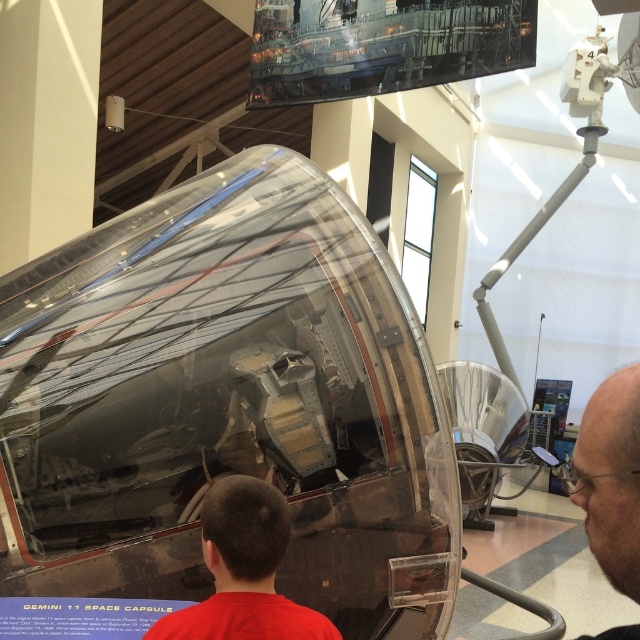
Which is below, red shirt at lower center or glossy bald head at upper right?

red shirt at lower center

Does red shirt at lower center have a larger size compared to glossy bald head at upper right?

Incorrect, red shirt at lower center is not larger than glossy bald head at upper right.

Locate an element on the screen. Image resolution: width=640 pixels, height=640 pixels. red shirt at lower center is located at coordinates (243, 572).